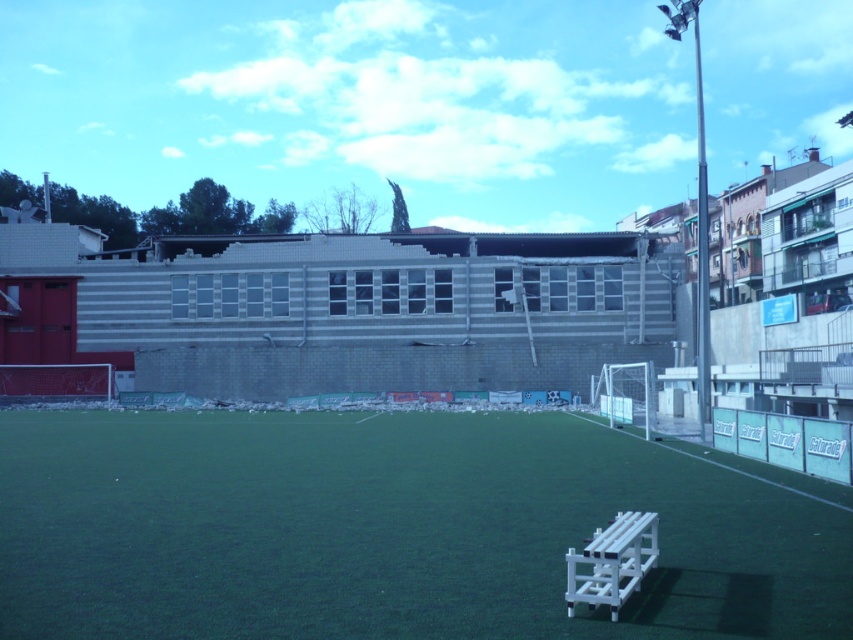
You are a soccer player standing on the field and want to sit down. The white plastic bench at lower right is available. Considering the height of the bench compared to the green artificial turf at center, will your knees be higher than the turf when sitting?

The green artificial turf at center is taller than the white plastic bench at lower right, so when sitting on the bench, your knees would be lower than the turf.

You are a soccer coach planning to set up a training drill on the field. You need to place a large equipment box on the green artificial turf at center without overlapping the white plastic bench at lower right. Is there enough space?

The green artificial turf at center has a larger size compared to white plastic bench at lower right, so there is enough space to place the equipment box on the green artificial turf at center without overlapping the bench.

You are standing at the point marked by the coordinates point [390,531] on the soccer field. Looking around, you see the white bench on the bottom right and the partially demolished building in the background. Which direction should you walk to reach the white bench on the bottom right first?

Since you are at the point marked by the coordinates point [390,531], which is the green artificial turf at center, you should walk towards the bottom right direction to reach the white bench on the bottom right first.